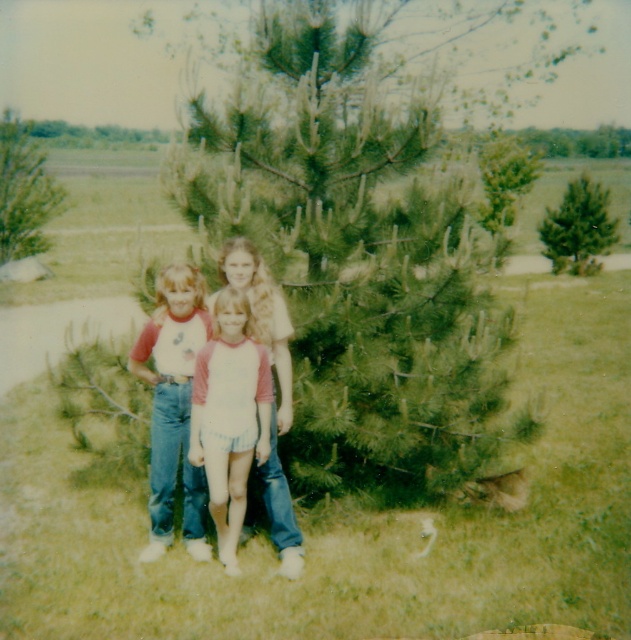
Question: Among these points, which one is nearest to the camera?

Choices:
 (A) (175, 449)
 (B) (227, 378)
 (C) (558, 216)

Answer: (B)

Question: Which is nearer to the denim jeans at center?

Choices:
 (A) green leafy tree at upper left
 (B) white cotton shirt at center

Answer: (B)

Question: Which object is farther from the camera taking this photo?

Choices:
 (A) denim jeans at center
 (B) white cotton shirt at center

Answer: (A)

Question: Can you confirm if white cotton shirt at center is positioned above denim jeans at center?

Choices:
 (A) no
 (B) yes

Answer: (A)

Question: Is white cotton shirt at center thinner than green leafy tree at upper left?

Choices:
 (A) no
 (B) yes

Answer: (B)

Question: Is green leafy tree at upper left wider than green matte pine at upper right?

Choices:
 (A) yes
 (B) no

Answer: (A)